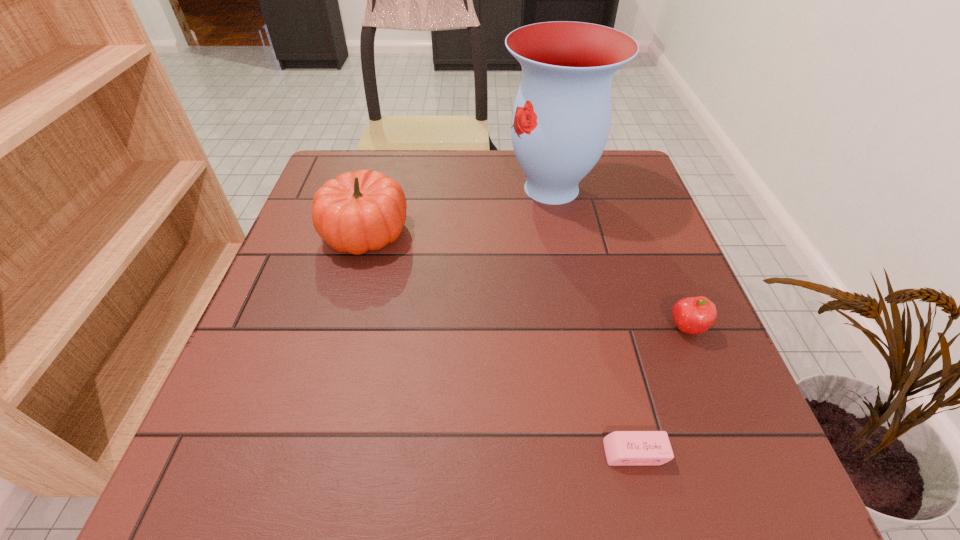
Image resolution: width=960 pixels, height=540 pixels. Identify the location of free space located 0.110m on the back of the shortest object. point(616,377).

Find the location of a particular element. This screenshot has height=540, width=960. object that is at the far edge is located at coordinates (561, 119).

What are the coordinates of `object present at the near edge` in the screenshot? It's located at tap(622, 448).

The image size is (960, 540). I want to click on object situated at the left edge, so click(356, 212).

Find the location of a particular element. The height and width of the screenshot is (540, 960). vase that is at the right edge is located at coordinates (561, 119).

Identify the location of apple present at the right edge. This screenshot has width=960, height=540. (692, 315).

Where is `eraser at the right edge`? The width and height of the screenshot is (960, 540). eraser at the right edge is located at coordinates (622, 448).

At what (x,y) coordinates should I click in order to perform the action: click on object located at the far right corner. Please return your answer as a coordinate pair (x, y). The width and height of the screenshot is (960, 540). Looking at the image, I should click on (561, 119).

The image size is (960, 540). In order to click on object at the near right corner in this screenshot , I will do `click(622, 448)`.

This screenshot has width=960, height=540. What are the coordinates of `free space at the far edge of the desktop` in the screenshot? It's located at (384, 172).